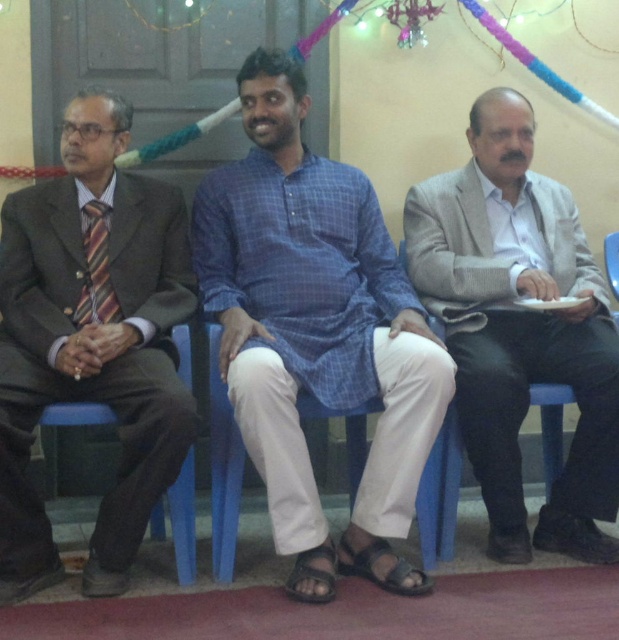
Question: Which point is farther to the camera?

Choices:
 (A) (305, 284)
 (B) (188, 432)

Answer: (A)

Question: Which object is the farthest from the gray woolen suit at right?

Choices:
 (A) matte brown suit at left
 (B) blue checkered kurta at center

Answer: (A)

Question: Does matte brown suit at left appear on the left side of blue plastic chair at center?

Choices:
 (A) yes
 (B) no

Answer: (A)

Question: Does matte brown suit at left appear on the left side of gray woolen suit at right?

Choices:
 (A) no
 (B) yes

Answer: (B)

Question: Which object appears farthest from the camera in this image?

Choices:
 (A) blue checkered kurta at center
 (B) matte brown suit at left
 (C) blue plastic chair at center
 (D) gray woolen suit at right

Answer: (D)

Question: Does blue checkered kurta at center lie behind gray woolen suit at right?

Choices:
 (A) yes
 (B) no

Answer: (B)